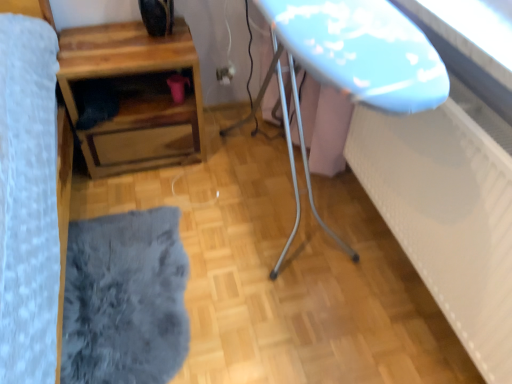
You are a GUI agent. You are given a task and a screenshot of the screen. Output one action in this format:
    pyautogui.click(x=<x>, y=<y>)
    Task: Click on the vacant area that is in front of wooden table at lower left
    The width and height of the screenshot is (512, 384).
    Given the screenshot: What is the action you would take?
    pyautogui.click(x=139, y=208)